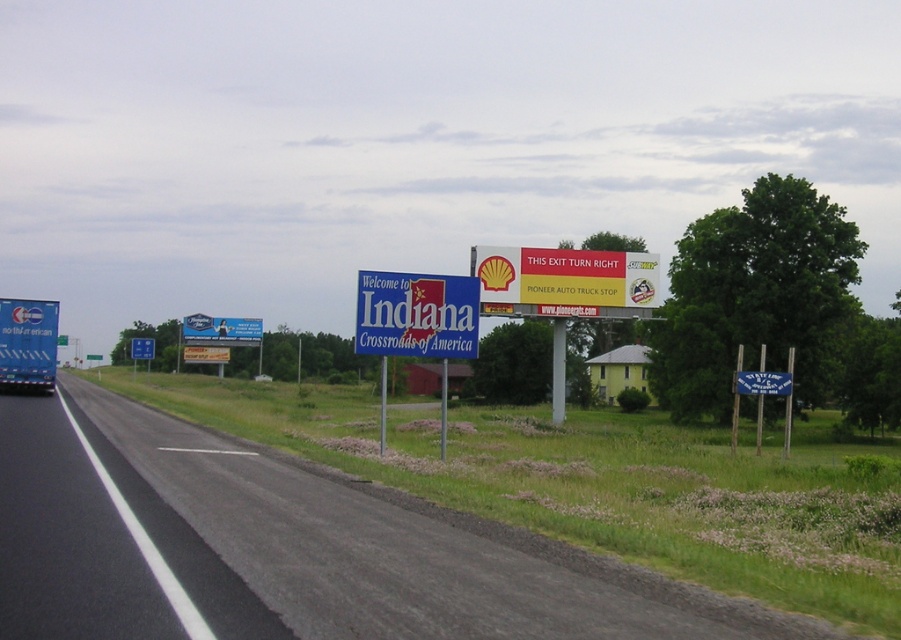
Looking at this image, you are driving a car and need to make a turn at the blue plastic sign at center. Your car has a turning radius of 12 meters. Can you safely turn without crossing the black asphalt road at center?

Answer: The distance between the black asphalt road at center and the blue plastic sign at center is 8.34 meters. Since your car requires a turning radius of 12 meters to safely turn, you will not be able to make the turn without crossing the road. You need a larger space to maneuver safely.

You are standing at the roadside in the scene and want to determine the distance between two points marked on the road. The first point is at coordinates point (547,589) and the second is at point (385,349). Which point is closer to you?

Point (547,589) is closer to the viewer than point (385,349).

You are a driver approaching the black asphalt road at center and the blue plastic sign at center. Which object will you encounter first?

The black asphalt road at center is closer to the viewer than the blue plastic sign at center, so you will encounter the black asphalt road at center first.